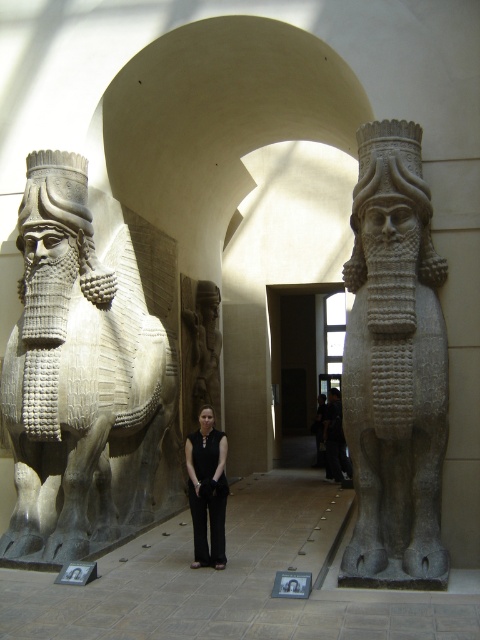
Question: Does gray stone lion at right appear on the left side of gray stone relief at center?

Choices:
 (A) yes
 (B) no

Answer: (B)

Question: Is gray stone lion at left positioned before black fabric pants at center?

Choices:
 (A) no
 (B) yes

Answer: (A)

Question: Which point appears closest to the camera in this image?

Choices:
 (A) (416, 317)
 (B) (191, 499)
 (C) (110, 262)
 (D) (187, 428)

Answer: (A)

Question: Which object is closer to the camera taking this photo?

Choices:
 (A) gray stone relief at center
 (B) black fabric pants at center

Answer: (B)

Question: Can you confirm if gray stone lion at right is thinner than gray stone relief at center?

Choices:
 (A) no
 (B) yes

Answer: (A)

Question: Which object appears farthest from the camera in this image?

Choices:
 (A) gray stone lion at right
 (B) gray stone relief at center
 (C) black fabric pants at center

Answer: (B)